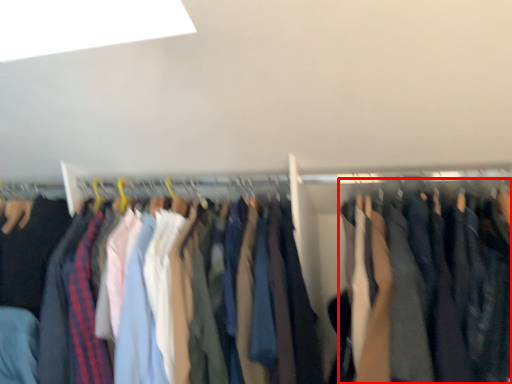
Question: Where is clothing (annotated by the red box) located in relation to trousers in the image?

Choices:
 (A) right
 (B) left

Answer: (A)